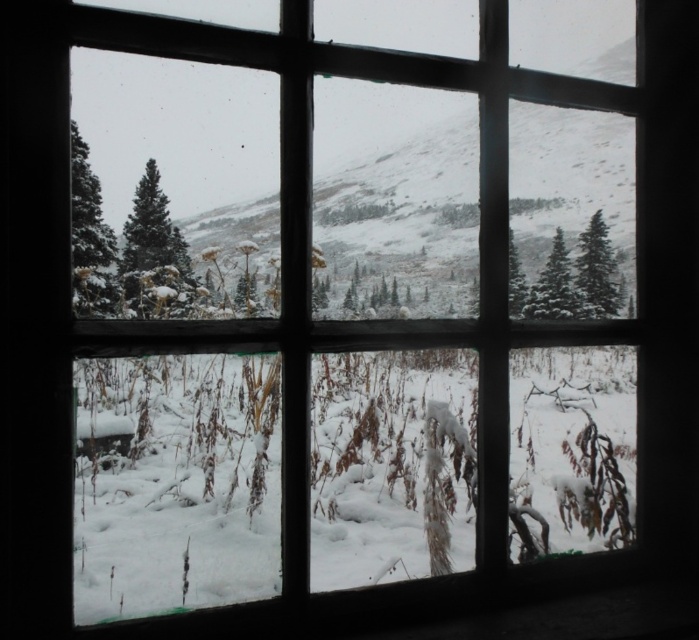
You are standing in a room looking through the window at the winter scene. There are two points marked on the window frame at coordinates point [610,308] and point [575,285]. If you want to touch the point that is closer to you, which coordinate should you aim for?

Point [575,285] is closer to you than point [610,308], so you should aim for point [575,285].